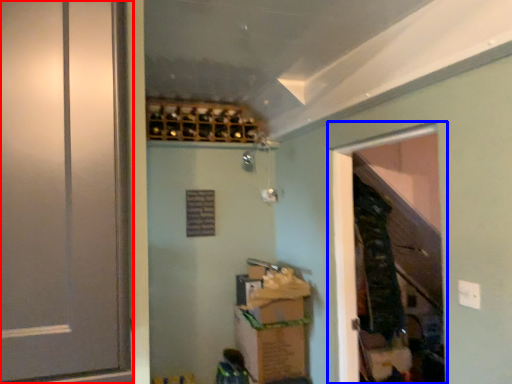
Question: Which point is further to the camera, door (highlighted by a red box) or screen door (highlighted by a blue box)?

Choices:
 (A) door
 (B) screen door

Answer: (B)